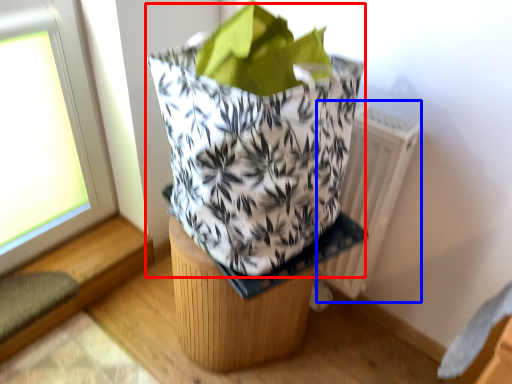
Question: Which of the following is the farthest to the observer, grocery bag (highlighted by a red box) or radiator (highlighted by a blue box)?

Choices:
 (A) grocery bag
 (B) radiator

Answer: (B)